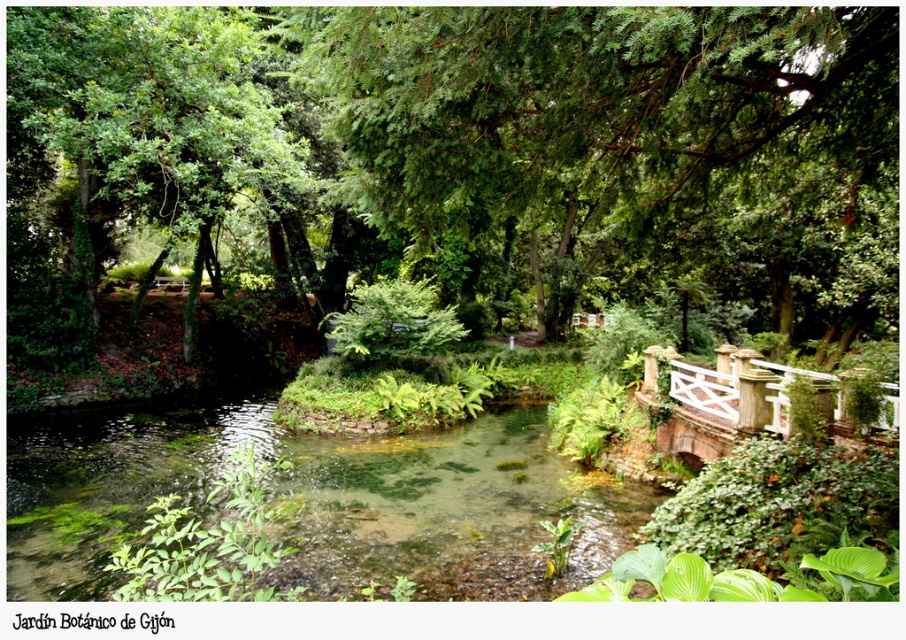
Looking at this image, between green leafy tree at upper left and white wooden bridge at right, which one is positioned lower?

white wooden bridge at right is lower down.

Which is behind, point (79, 67) or point (644, 394)?

Point (79, 67)

The width and height of the screenshot is (906, 640). In order to click on green leafy tree at upper left in this screenshot , I will do `click(122, 147)`.

Image resolution: width=906 pixels, height=640 pixels. Identify the location of green leafy tree at upper left. (122, 147).

Is green leafy tree at center taller than white wooden bridge at right?

Yes.

How much distance is there between green leafy tree at center and white wooden bridge at right?

They are 12.00 meters apart.

At what (x,y) coordinates should I click in order to perform the action: click on green leafy tree at center. Please return your answer as a coordinate pair (x, y). Looking at the image, I should click on pos(465,152).

Who is positioned more to the left, green leafy tree at center or green leafy tree at upper left?

Positioned to the left is green leafy tree at upper left.

Between green leafy tree at center and green leafy tree at upper left, which one has less height?

With less height is green leafy tree at center.

At what (x,y) coordinates should I click in order to perform the action: click on green leafy tree at center. Please return your answer as a coordinate pair (x, y). The height and width of the screenshot is (640, 906). Looking at the image, I should click on (465, 152).

At what (x,y) coordinates should I click in order to perform the action: click on green leafy tree at center. Please return your answer as a coordinate pair (x, y). Image resolution: width=906 pixels, height=640 pixels. Looking at the image, I should click on (465, 152).